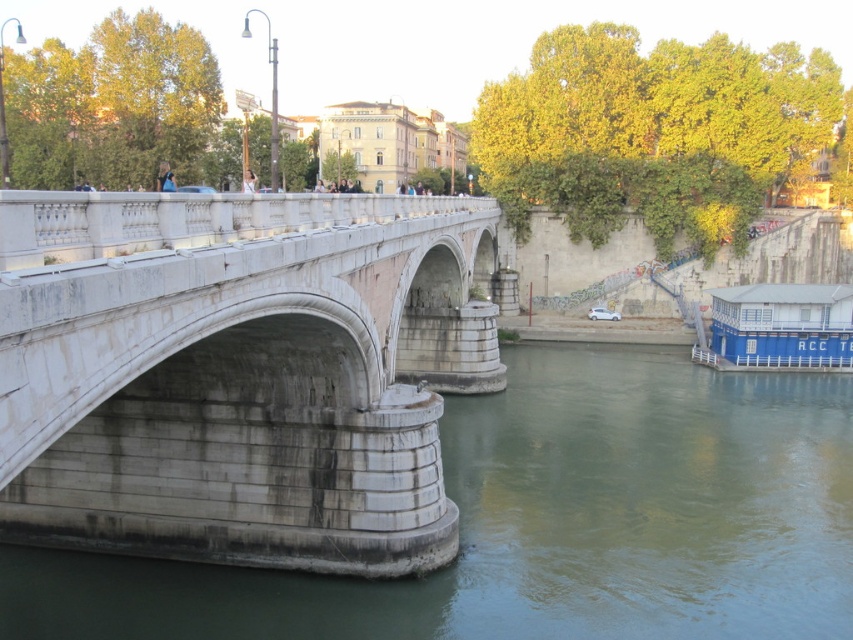
Between point (177, 432) and point (646, 634), which one is positioned in front?

Point (646, 634) is in front.

Based on the photo, between white stone bridge at center and greenish concrete river at lower left, which one has more height?

With more height is white stone bridge at center.

What do you see at coordinates (239, 372) in the screenshot? The height and width of the screenshot is (640, 853). I see `white stone bridge at center` at bounding box center [239, 372].

Where is `white stone bridge at center`? Image resolution: width=853 pixels, height=640 pixels. white stone bridge at center is located at coordinates (239, 372).